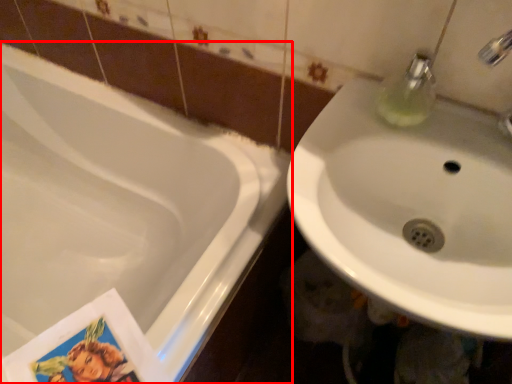
Question: From the image's perspective, what is the correct spatial relationship of bathtub (annotated by the red box) in relation to sink?

Choices:
 (A) below
 (B) above

Answer: (A)